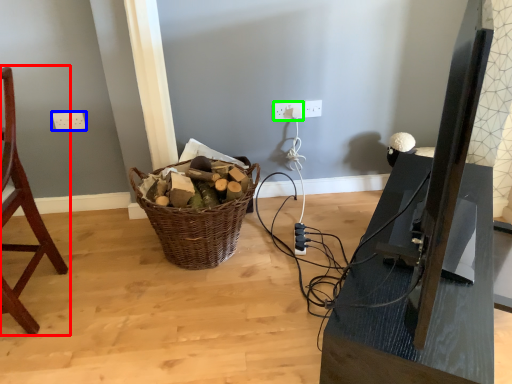
Question: Which object is positioned closest to chair (highlighted by a red box)? Select from electric outlet (highlighted by a blue box) and electric outlet (highlighted by a green box).

Choices:
 (A) electric outlet
 (B) electric outlet

Answer: (A)